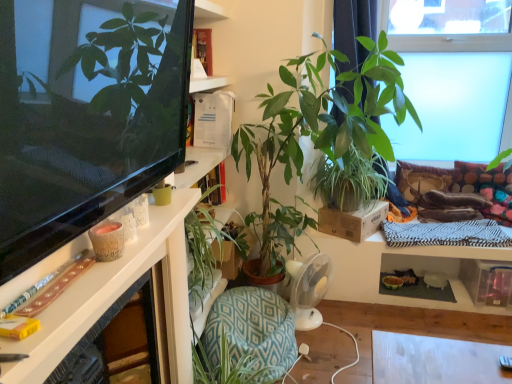
Locate an element on the screen. transparent glass window at upper right is located at coordinates pyautogui.click(x=451, y=42).

Measure the distance between point (203, 210) and camera.

Point (203, 210) is 6.00 feet from camera.

Describe the element at coordinates (205, 251) in the screenshot. This screenshot has width=512, height=384. I see `green leafy plant at center, which ranks as the fourth houseplant in right-to-left order` at that location.

The height and width of the screenshot is (384, 512). Identify the location of velvet brown pillow at upper right, the 2th pillow positioned from the right. click(421, 179).

Describe the element at coordinates (421, 179) in the screenshot. This screenshot has width=512, height=384. I see `velvet brown pillow at upper right, acting as the first pillow starting from the left` at that location.

Image resolution: width=512 pixels, height=384 pixels. Describe the element at coordinates (478, 176) in the screenshot. I see `multicolored fabric pillow at right, placed as the 2th pillow when sorted from left to right` at that location.

How much space does multicolored fabric pillow at right, placed as the 2th pillow when sorted from left to right, occupy horizontally?

multicolored fabric pillow at right, placed as the 2th pillow when sorted from left to right, is 3.59 inches in width.

Find the location of `transparent glass window at upper right`. transparent glass window at upper right is located at coordinates (451, 42).

Does green leafy plant at center, marked as the second houseplant in a right-to-left arrangement, touch multicolored fabric pillow at right, placed as the 2th pillow when sorted from left to right?

No, green leafy plant at center, marked as the second houseplant in a right-to-left arrangement, is not with multicolored fabric pillow at right, placed as the 2th pillow when sorted from left to right.

Can you confirm if green leafy plant at center, which ranks as the third houseplant in left-to-right order, is bigger than multicolored fabric pillow at right, the first pillow positioned from the right?

Indeed, green leafy plant at center, which ranks as the third houseplant in left-to-right order, has a larger size compared to multicolored fabric pillow at right, the first pillow positioned from the right.

Does green leafy plant at center, which ranks as the third houseplant in left-to-right order, have a lesser width compared to multicolored fabric pillow at right, placed as the 2th pillow when sorted from left to right?

In fact, green leafy plant at center, which ranks as the third houseplant in left-to-right order, might be wider than multicolored fabric pillow at right, placed as the 2th pillow when sorted from left to right.

From a real-world perspective, is green leafy plant at center, which ranks as the third houseplant in left-to-right order, on top of multicolored fabric pillow at right, the first pillow positioned from the right?

Indeed, from a real-world perspective, green leafy plant at center, which ranks as the third houseplant in left-to-right order, stands above multicolored fabric pillow at right, the first pillow positioned from the right.

Is velvet brown pillow at upper right, acting as the first pillow starting from the left, wider or thinner than multicolored fabric pillow at right, the first pillow positioned from the right?

In the image, velvet brown pillow at upper right, acting as the first pillow starting from the left, appears to be more narrow than multicolored fabric pillow at right, the first pillow positioned from the right.

Consider the image. Can you confirm if velvet brown pillow at upper right, acting as the first pillow starting from the left, is taller than multicolored fabric pillow at right, placed as the 2th pillow when sorted from left to right?

Correct, velvet brown pillow at upper right, acting as the first pillow starting from the left, is much taller as multicolored fabric pillow at right, placed as the 2th pillow when sorted from left to right.

Is multicolored fabric pillow at right, the first pillow positioned from the right, at the back of velvet brown pillow at upper right, acting as the first pillow starting from the left?

No, velvet brown pillow at upper right, acting as the first pillow starting from the left,'s orientation is not away from multicolored fabric pillow at right, the first pillow positioned from the right.

Find the location of a particular element. pillow to the right of velvet brown pillow at upper right, acting as the first pillow starting from the left is located at coordinates (478, 176).

Which of these two, velvet brown pillow at upper right, acting as the first pillow starting from the left, or white glossy desk at left, stands shorter?

With less height is white glossy desk at left.

Would you consider velvet brown pillow at upper right, the 2th pillow positioned from the right, to be distant from white glossy desk at left?

Absolutely, velvet brown pillow at upper right, the 2th pillow positioned from the right, is distant from white glossy desk at left.

Which point is more distant from viewer, (402, 167) or (42, 326)?

Positioned behind is point (402, 167).

Is velvet brown pillow at upper right, the 2th pillow positioned from the right, closer to camera compared to white glossy desk at left?

No, velvet brown pillow at upper right, the 2th pillow positioned from the right, is behind white glossy desk at left.

Based on their positions, is multicolored fabric pillow at right, placed as the 2th pillow when sorted from left to right, located to the left or right of velvet brown pillow at upper right, the 2th pillow positioned from the right?

multicolored fabric pillow at right, placed as the 2th pillow when sorted from left to right, is positioned on velvet brown pillow at upper right, the 2th pillow positioned from the right,'s right side.

Considering the sizes of multicolored fabric pillow at right, placed as the 2th pillow when sorted from left to right, and velvet brown pillow at upper right, the 2th pillow positioned from the right, in the image, is multicolored fabric pillow at right, placed as the 2th pillow when sorted from left to right, bigger or smaller than velvet brown pillow at upper right, the 2th pillow positioned from the right,?

In the image, multicolored fabric pillow at right, placed as the 2th pillow when sorted from left to right, appears to be smaller than velvet brown pillow at upper right, the 2th pillow positioned from the right.

Consider the image. Can you tell me how much multicolored fabric pillow at right, the first pillow positioned from the right, and velvet brown pillow at upper right, acting as the first pillow starting from the left, differ in facing direction?

The angular difference between multicolored fabric pillow at right, the first pillow positioned from the right, and velvet brown pillow at upper right, acting as the first pillow starting from the left, is 1.09 degrees.

Is multicolored fabric pillow at right, the first pillow positioned from the right, next to velvet brown pillow at upper right, the 2th pillow positioned from the right?

No, multicolored fabric pillow at right, the first pillow positioned from the right, is not making contact with velvet brown pillow at upper right, the 2th pillow positioned from the right.

From a real-world perspective, is green leafy plant at center, which ranks as the third houseplant in left-to-right order, physically below transparent glass window at upper right?

Yes, from a real-world perspective, green leafy plant at center, which ranks as the third houseplant in left-to-right order, is beneath transparent glass window at upper right.

Which of these two, green leafy plant at center, which ranks as the third houseplant in left-to-right order, or transparent glass window at upper right, stands shorter?

Standing shorter between the two is green leafy plant at center, which ranks as the third houseplant in left-to-right order.

Does point (348, 167) come closer to viewer compared to point (404, 35)?

Yes, it is in front of point (404, 35).

Is green leafy plant at center, marked as the second houseplant in a right-to-left arrangement, far from transparent glass window at upper right?

That's right, there is a large distance between green leafy plant at center, marked as the second houseplant in a right-to-left arrangement, and transparent glass window at upper right.

From the image's perspective, is transparent glass window at upper right on top of green leafy plant at center, which appears as the 3th houseplant when viewed from the right?

Yes, from the image's perspective, transparent glass window at upper right is above green leafy plant at center, which appears as the 3th houseplant when viewed from the right.

From a real-world perspective, who is located higher, transparent glass window at upper right or green leafy plant at center, which appears as the 3th houseplant when viewed from the right?

From a 3D spatial view, transparent glass window at upper right is above.

Which object is positioned more to the left, transparent glass window at upper right or green leafy plant at center, which appears as the 3th houseplant when viewed from the right?

green leafy plant at center, which appears as the 3th houseplant when viewed from the right, is more to the left.

I want to click on the 3rd houseplant to the left of the transparent glass window at upper right, starting your count from the anchor, so click(x=322, y=120).

From the image's perspective, does green leafy plant at center, which ranks as the third houseplant in left-to-right order, appear lower than green leafy plant at center, acting as the 1th houseplant starting from the left?

Actually, green leafy plant at center, which ranks as the third houseplant in left-to-right order, appears above green leafy plant at center, acting as the 1th houseplant starting from the left, in the image.

From a real-world perspective, is green leafy plant at center, marked as the second houseplant in a right-to-left arrangement, located higher than green leafy plant at center, acting as the 1th houseplant starting from the left?

Indeed, from a real-world perspective, green leafy plant at center, marked as the second houseplant in a right-to-left arrangement, stands above green leafy plant at center, acting as the 1th houseplant starting from the left.

Is green leafy plant at center, which ranks as the third houseplant in left-to-right order, closer to camera compared to green leafy plant at center, acting as the 1th houseplant starting from the left?

No, it is not.

Considering the relative sizes of green leafy plant at center, marked as the second houseplant in a right-to-left arrangement, and green leafy plant at center, acting as the 1th houseplant starting from the left, in the image provided, is green leafy plant at center, marked as the second houseplant in a right-to-left arrangement, smaller than green leafy plant at center, acting as the 1th houseplant starting from the left,?

Actually, green leafy plant at center, marked as the second houseplant in a right-to-left arrangement, might be larger than green leafy plant at center, acting as the 1th houseplant starting from the left.

I want to click on the 1st pillow below the green leafy plant at center, marked as the second houseplant in a right-to-left arrangement (from a real-world perspective), so click(x=478, y=176).

Find the location of a particular element. Image resolution: width=512 pixels, height=384 pixels. pillow that is behind the multicolored fabric pillow at right, placed as the 2th pillow when sorted from left to right is located at coordinates (421, 179).

Considering their positions, is transparent glass window at upper right positioned closer to green leafy plant at center, which ranks as the fourth houseplant in right-to-left order, than velvet brown pillow at upper right, the 2th pillow positioned from the right?

velvet brown pillow at upper right, the 2th pillow positioned from the right, is positioned closer to the anchor green leafy plant at center, which ranks as the fourth houseplant in right-to-left order.

When comparing their distances from transparent glass window at upper right, does green leafy plant at center, acting as the 2th houseplant starting from the left, or multicolored fabric pillow at right, placed as the 2th pillow when sorted from left to right, seem closer?

multicolored fabric pillow at right, placed as the 2th pillow when sorted from left to right.

Looking at the image, which one is located closer to green leafy plant at center, acting as the 1th houseplant starting from the left, transparent glass window at upper right or green leafy plant at center, marked as the second houseplant in a right-to-left arrangement?

green leafy plant at center, marked as the second houseplant in a right-to-left arrangement, lies closer to green leafy plant at center, acting as the 1th houseplant starting from the left, than the other object.

From the image, which object appears to be nearer to green leafy plant at center, acting as the 1th houseplant starting from the left, white glossy desk at left or green leafy plant at upper right, placed as the 4th houseplant when sorted from left to right?

Among the two, white glossy desk at left is located nearer to green leafy plant at center, acting as the 1th houseplant starting from the left.

Considering their positions, is green leafy plant at center, which appears as the 3th houseplant when viewed from the right, positioned closer to multicolored fabric pillow at right, placed as the 2th pillow when sorted from left to right, than green leafy plant at center, which ranks as the fourth houseplant in right-to-left order?

The object closer to multicolored fabric pillow at right, placed as the 2th pillow when sorted from left to right, is green leafy plant at center, which appears as the 3th houseplant when viewed from the right.

Considering their positions, is green leafy plant at upper right, which ranks as the 1th houseplant in right-to-left order, positioned further to green leafy plant at center, acting as the 2th houseplant starting from the left, than green leafy plant at center, acting as the 1th houseplant starting from the left?

The object further to green leafy plant at center, acting as the 2th houseplant starting from the left, is green leafy plant at center, acting as the 1th houseplant starting from the left.

Looking at the image, which one is located further to multicolored fabric pillow at right, placed as the 2th pillow when sorted from left to right, velvet brown pillow at upper right, acting as the first pillow starting from the left, or transparent glass window at upper right?

Based on the image, transparent glass window at upper right appears to be further to multicolored fabric pillow at right, placed as the 2th pillow when sorted from left to right.

Estimate the real-world distances between objects in this image. Which object is closer to white glossy desk at left, green leafy plant at center, which appears as the 3th houseplant when viewed from the right, or velvet brown pillow at upper right, the 2th pillow positioned from the right?

green leafy plant at center, which appears as the 3th houseplant when viewed from the right, is closer to white glossy desk at left.

Where is `pillow between green leafy plant at center, marked as the second houseplant in a right-to-left arrangement, and multicolored fabric pillow at right, the first pillow positioned from the right, in the horizontal direction`? pillow between green leafy plant at center, marked as the second houseplant in a right-to-left arrangement, and multicolored fabric pillow at right, the first pillow positioned from the right, in the horizontal direction is located at coordinates (421, 179).

In order to click on pillow between green leafy plant at center, which ranks as the third houseplant in left-to-right order, and transparent glass window at upper right in this screenshot , I will do `click(421, 179)`.

At what (x,y) coordinates should I click in order to perform the action: click on houseplant located between green leafy plant at center, marked as the second houseplant in a right-to-left arrangement, and transparent glass window at upper right in the left-right direction. Please return your answer as a coordinate pair (x, y). Image resolution: width=512 pixels, height=384 pixels. Looking at the image, I should click on (370, 96).

I want to click on pillow located between green leafy plant at center, which appears as the 3th houseplant when viewed from the right, and velvet brown pillow at upper right, the 2th pillow positioned from the right, in the depth direction, so click(x=478, y=176).